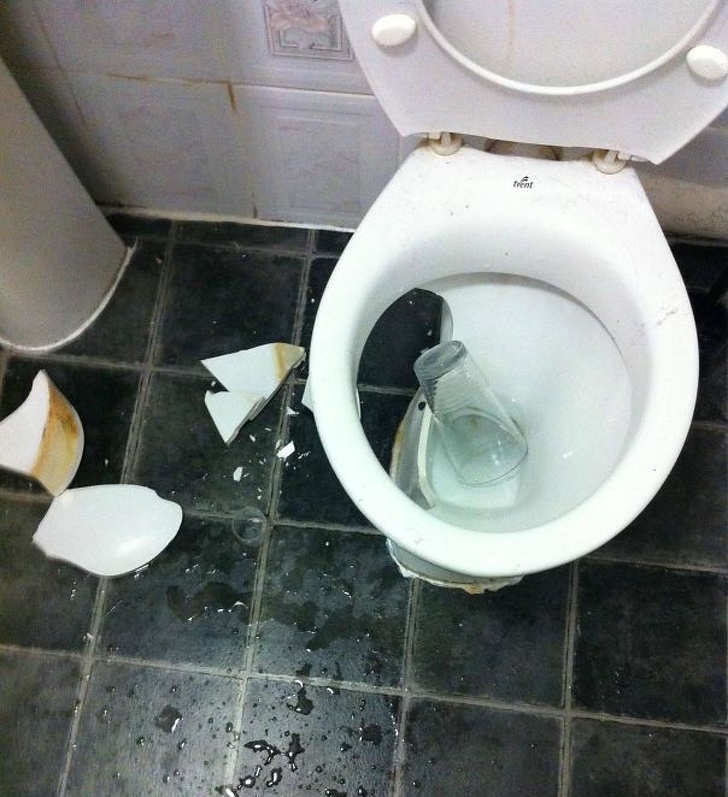
Locate an element on the screen. splatter of liquid on floor is located at coordinates (264, 607).